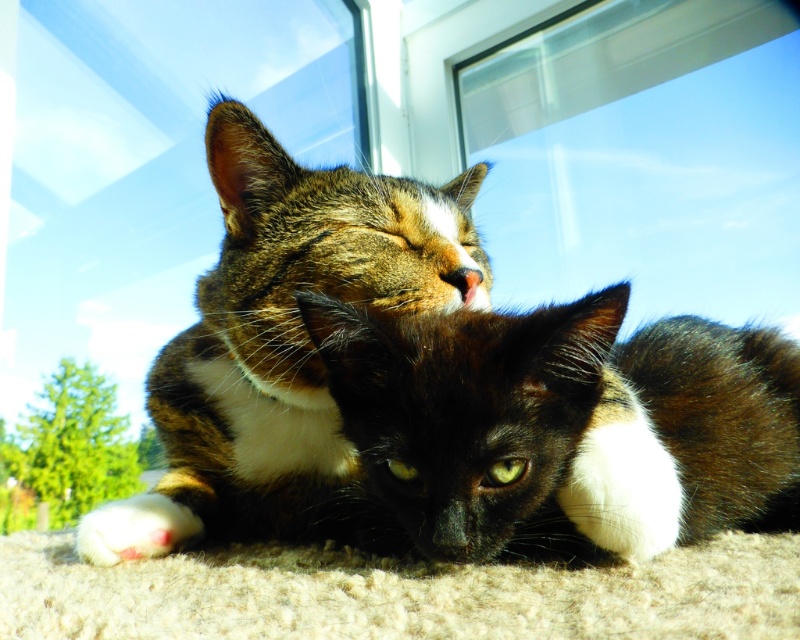
Question: Does calico fur cat at center have a lesser width compared to white fluffy paw at lower left?

Choices:
 (A) yes
 (B) no

Answer: (B)

Question: Is the position of calico fur cat at center more distant than that of black fur cat at center?

Choices:
 (A) yes
 (B) no

Answer: (A)

Question: Among these objects, which one is farthest from the camera?

Choices:
 (A) black fur cat at center
 (B) white fluffy paw at lower left

Answer: (B)

Question: Does calico fur cat at center have a smaller size compared to black fur cat at center?

Choices:
 (A) yes
 (B) no

Answer: (B)

Question: Which object is farther from the camera taking this photo?

Choices:
 (A) black fur cat at center
 (B) calico fur cat at center
 (C) white fluffy paw at lower left

Answer: (C)

Question: Which object is farther from the camera taking this photo?

Choices:
 (A) white fluffy paw at lower left
 (B) black fur cat at center
 (C) calico fur cat at center

Answer: (A)